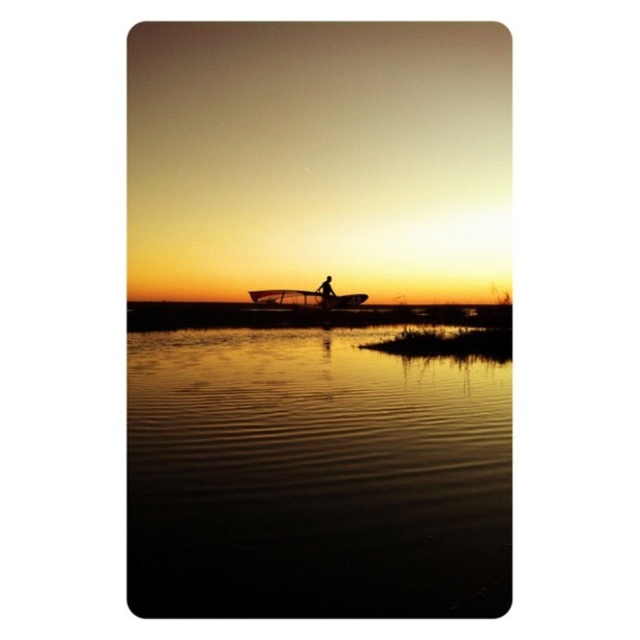
Can you confirm if glossy reflective water at center is positioned below metallic silver boat at center?

Yes, glossy reflective water at center is below metallic silver boat at center.

Based on the photo, can you confirm if glossy reflective water at center is positioned above metallic silver boat at center?

Actually, glossy reflective water at center is below metallic silver boat at center.

Between point (502, 612) and point (364, 294), which one is positioned in front?

Point (502, 612) is more forward.

This screenshot has width=640, height=640. In order to click on glossy reflective water at center in this screenshot , I will do `click(316, 476)`.

Does glossy reflective water at center appear over silhouette figure at center?

Incorrect, glossy reflective water at center is not positioned above silhouette figure at center.

Does point (396, 484) lie in front of point (321, 284)?

Yes, it is.

Who is more forward, (134, 513) or (328, 300)?

Positioned in front is point (134, 513).

The image size is (640, 640). I want to click on glossy reflective water at center, so click(316, 476).

Can you confirm if metallic silver boat at center is positioned to the right of silhouette figure at center?

In fact, metallic silver boat at center is to the left of silhouette figure at center.

Can you confirm if metallic silver boat at center is positioned to the left of silhouette figure at center?

Correct, you'll find metallic silver boat at center to the left of silhouette figure at center.

Where is `metallic silver boat at center`? metallic silver boat at center is located at coordinates (307, 298).